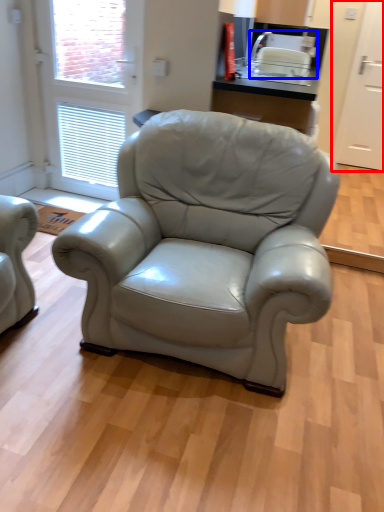
Question: Among these objects, which one is farthest to the camera, screen door (highlighted by a red box) or appliance (highlighted by a blue box)?

Choices:
 (A) screen door
 (B) appliance

Answer: (A)